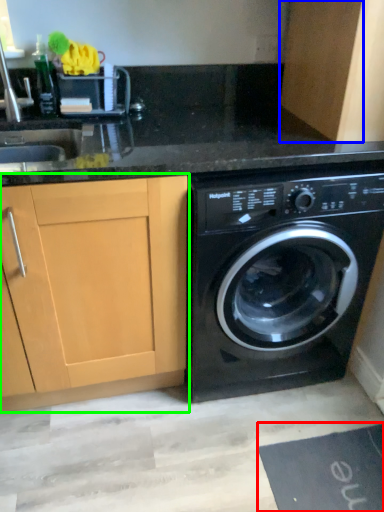
Question: Considering the real-world distances, which object is closest to bath mat (highlighted by a red box)? cabinetry (highlighted by a blue box) or cabinetry (highlighted by a green box).

Choices:
 (A) cabinetry
 (B) cabinetry

Answer: (B)